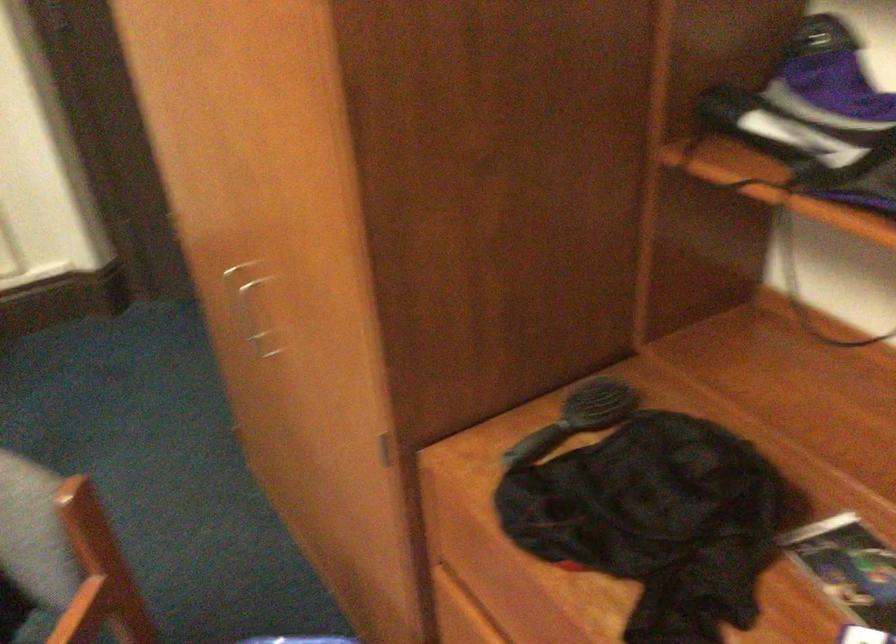
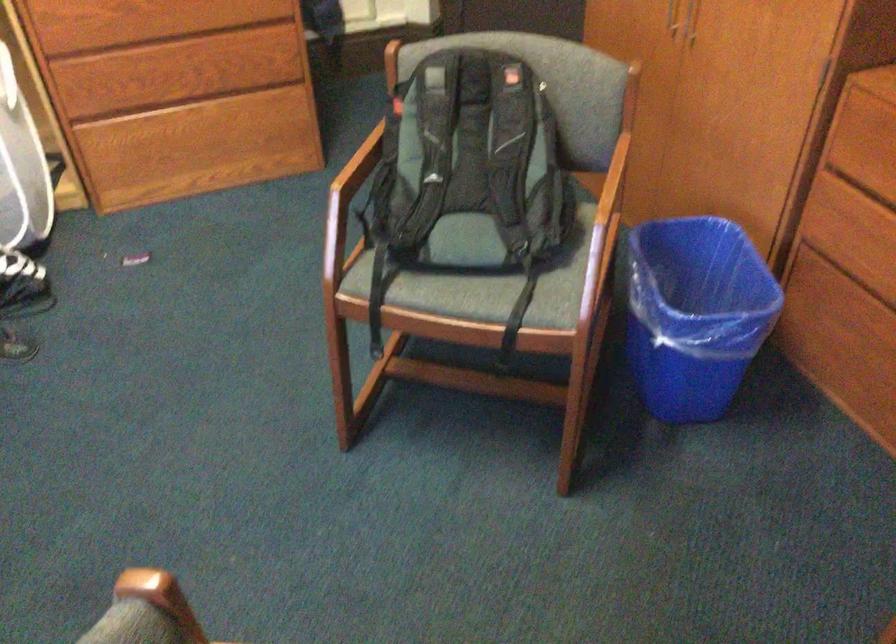
In the second image, find the point that corresponds to point 259,335 in the first image.

(691, 21)